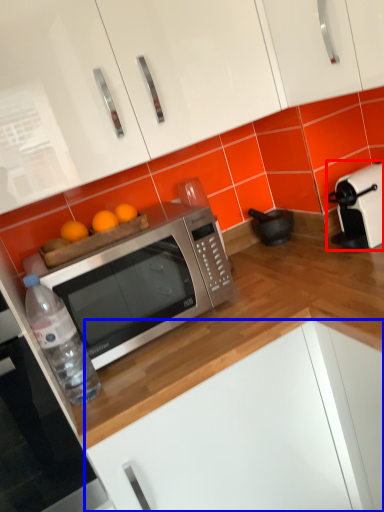
Question: Which object is further to the camera taking this photo, toaster (highlighted by a red box) or cabinetry (highlighted by a blue box)?

Choices:
 (A) toaster
 (B) cabinetry

Answer: (A)